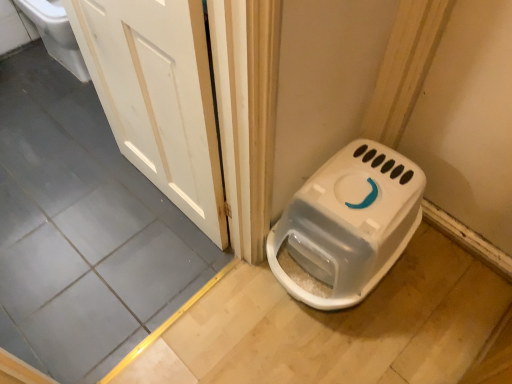
The image size is (512, 384). Find the location of `vacant space to the left of white plastic litter box at lower right`. vacant space to the left of white plastic litter box at lower right is located at coordinates (227, 310).